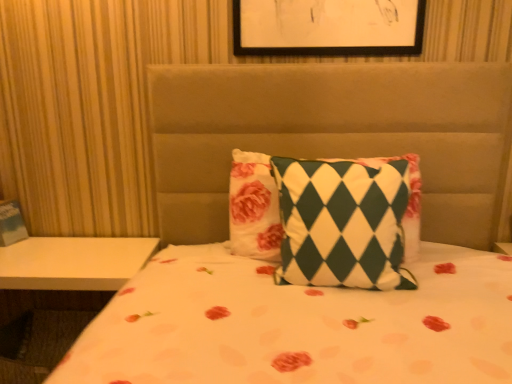
Question: Is white glossy table at lower left wider or thinner than green and white checkered pillow at center?

Choices:
 (A) wide
 (B) thin

Answer: (A)

Question: Is point (57, 337) closer or farther from the camera than point (261, 221)?

Choices:
 (A) closer
 (B) farther

Answer: (B)

Question: From the image's perspective, is white glossy table at lower left located above or below green and white checkered pillow at center?

Choices:
 (A) below
 (B) above

Answer: (A)

Question: Is green and white checkered pillow at center inside the boundaries of white glossy table at lower left, or outside?

Choices:
 (A) inside
 (B) outside

Answer: (B)

Question: From a real-world perspective, is green and white checkered pillow at center physically located above or below white glossy table at lower left?

Choices:
 (A) above
 (B) below

Answer: (A)

Question: Is green and white checkered pillow at center taller or shorter than white glossy table at lower left?

Choices:
 (A) tall
 (B) short

Answer: (B)

Question: In the image, is green and white checkered pillow at center positioned in front of or behind white glossy table at lower left?

Choices:
 (A) behind
 (B) front

Answer: (B)